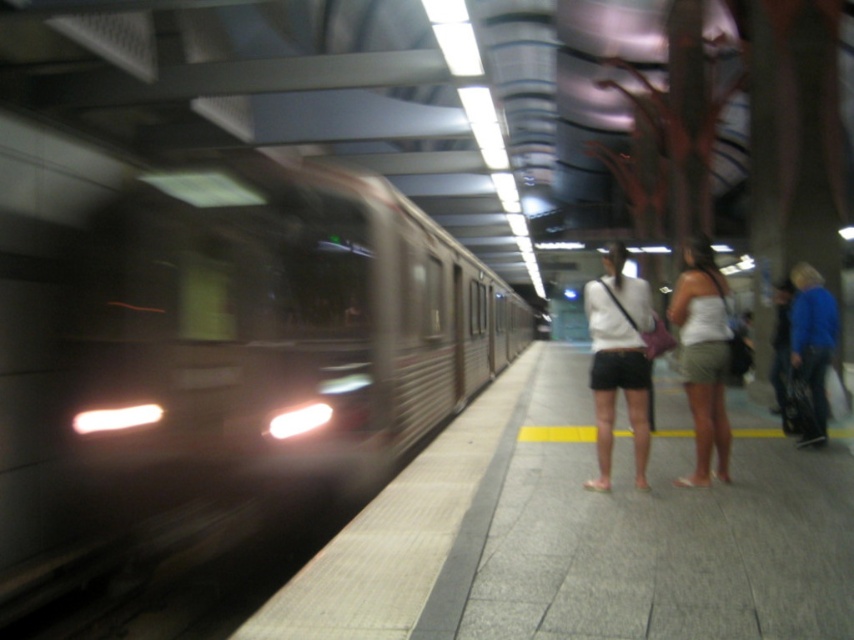
Is gray concrete platform at center to the right of blue denim jeans at right from the viewer's perspective?

In fact, gray concrete platform at center is to the left of blue denim jeans at right.

The width and height of the screenshot is (854, 640). In order to click on gray concrete platform at center in this screenshot , I will do `click(578, 536)`.

Who is higher up, white cotton tank top at center or blue denim jeans at right?

white cotton tank top at center is higher up.

Locate an element on the screen. Image resolution: width=854 pixels, height=640 pixels. white cotton tank top at center is located at coordinates (703, 356).

Between point (689, 620) and point (700, 477), which one is positioned behind?

Point (700, 477)

Can you confirm if gray concrete platform at center is positioned to the left of white cotton tank top at center?

Indeed, gray concrete platform at center is positioned on the left side of white cotton tank top at center.

Which is in front, point (746, 499) or point (683, 342)?

Point (746, 499)

The width and height of the screenshot is (854, 640). I want to click on gray concrete platform at center, so click(x=578, y=536).